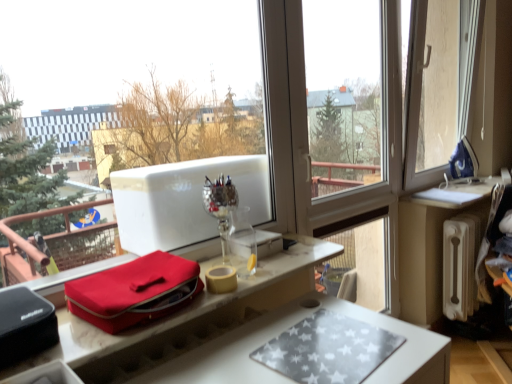
Question: From the image's perspective, is blue fabric iron at upper right positioned above or below matte red bag at center?

Choices:
 (A) below
 (B) above

Answer: (B)

Question: From their relative heights in the image, would you say blue fabric iron at upper right is taller or shorter than matte red bag at center?

Choices:
 (A) short
 (B) tall

Answer: (B)

Question: Which object is the farthest from the matte red bag at center?

Choices:
 (A) white radiator at right
 (B) blue fabric iron at upper right
 (C) silver reflective wine glass at center
 (D) matte red bag at center

Answer: (B)

Question: Based on their relative distances, which object is farther from the blue fabric iron at upper right?

Choices:
 (A) silver reflective wine glass at center
 (B) matte red bag at center
 (C) matte red bag at center
 (D) white radiator at right

Answer: (C)